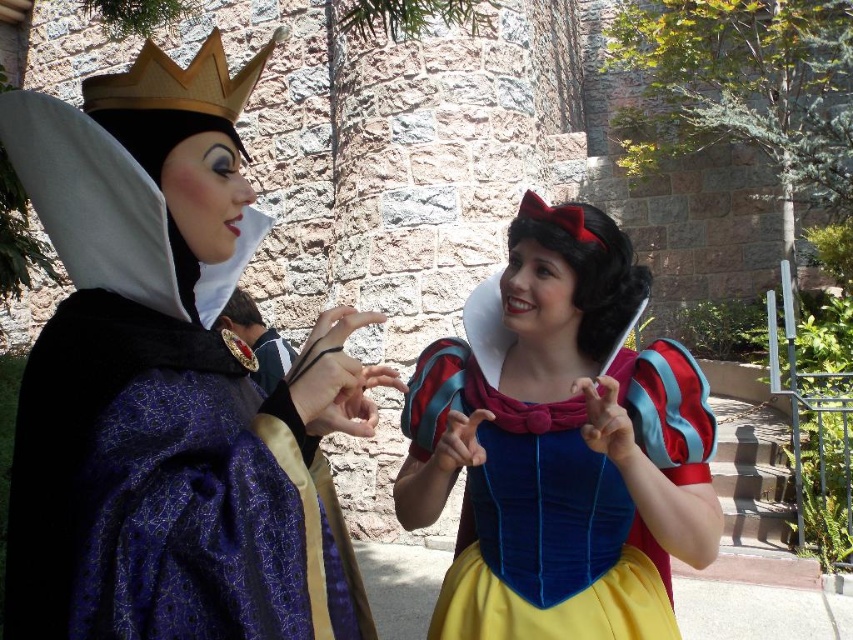
Question: Which point is farther to the camera?

Choices:
 (A) (157, 51)
 (B) (585, 364)

Answer: (B)

Question: Is shiny purple gown at left bigger than gold metallic crown at upper left?

Choices:
 (A) yes
 (B) no

Answer: (A)

Question: Can you confirm if velvet blue dress at center is positioned below gold metallic crown at upper left?

Choices:
 (A) no
 (B) yes

Answer: (B)

Question: Among these points, which one is nearest to the camera?

Choices:
 (A) 270,54
 (B) 471,442
 (C) 235,372

Answer: (C)

Question: Can you confirm if velvet blue dress at center is bigger than gold metallic crown at upper left?

Choices:
 (A) no
 (B) yes

Answer: (A)

Question: Considering the real-world distances, which object is closest to the shiny purple gown at left?

Choices:
 (A) gold metallic crown at upper left
 (B) velvet blue dress at center

Answer: (A)